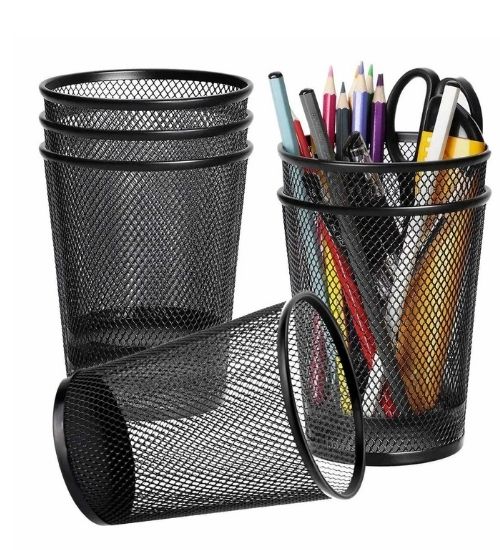
You are a GUI agent. You are given a task and a screenshot of the screen. Output one action in this format:
    pyautogui.click(x=<x>, y=<y>)
    Task: Click on the cup bottoms
    
    Given the screenshot: What is the action you would take?
    pyautogui.click(x=93, y=451), pyautogui.click(x=145, y=317), pyautogui.click(x=97, y=350), pyautogui.click(x=446, y=405), pyautogui.click(x=431, y=443), pyautogui.click(x=178, y=398)